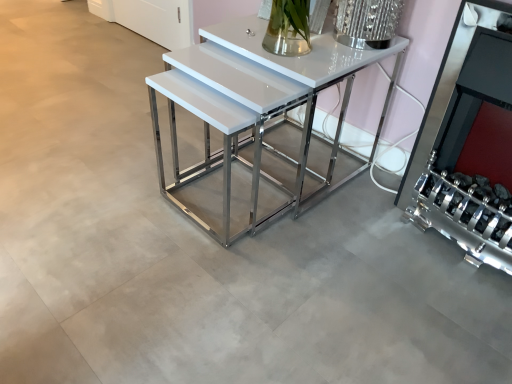
Measure the distance between white glossy table at center and camera.

white glossy table at center is 87.85 centimeters away from camera.

Describe the element at coordinates (259, 112) in the screenshot. I see `white glossy table at center` at that location.

This screenshot has width=512, height=384. In order to click on white glossy table at center in this screenshot , I will do `click(259, 112)`.

What is the approximate width of white glossy table at center?

The width of white glossy table at center is 25.65 inches.

This screenshot has height=384, width=512. Identify the location of silver metallic fireplace at right. (466, 139).

This screenshot has height=384, width=512. What do you see at coordinates (466, 139) in the screenshot? I see `silver metallic fireplace at right` at bounding box center [466, 139].

In order to click on white glossy table at center in this screenshot , I will do `click(259, 112)`.

Based on the photo, is white glossy table at center to the left of silver metallic fireplace at right from the viewer's perspective?

Yes.

Is the depth of white glossy table at center greater than that of silver metallic fireplace at right?

Yes, white glossy table at center is behind silver metallic fireplace at right.

Is point (239, 144) closer to viewer compared to point (469, 129)?

No, (239, 144) is further to viewer.

From the image's perspective, is white glossy table at center below silver metallic fireplace at right?

No.

From a real-world perspective, is white glossy table at center on top of silver metallic fireplace at right?

Incorrect, from a real-world perspective, white glossy table at center is lower than silver metallic fireplace at right.

Between white glossy table at center and silver metallic fireplace at right, which one has larger width?

white glossy table at center is wider.

Who is shorter, white glossy table at center or silver metallic fireplace at right?

With less height is white glossy table at center.

Does white glossy table at center have a larger size compared to silver metallic fireplace at right?

Indeed, white glossy table at center has a larger size compared to silver metallic fireplace at right.

Would you say white glossy table at center is inside or outside silver metallic fireplace at right?

white glossy table at center is outside silver metallic fireplace at right.

Would you consider white glossy table at center to be distant from silver metallic fireplace at right?

They are positioned close to each other.

Does white glossy table at center turn towards silver metallic fireplace at right?

No, white glossy table at center is not turned towards silver metallic fireplace at right.

How many degrees apart are the facing directions of white glossy table at center and silver metallic fireplace at right?

0.549 degrees.

How far apart are white glossy table at center and silver metallic fireplace at right?

white glossy table at center is 14.91 inches from silver metallic fireplace at right.

Locate an element on the screen. table on the left of silver metallic fireplace at right is located at coordinates (259, 112).

Does silver metallic fireplace at right appear on the right side of white glossy table at center?

Yes.

In the image, is silver metallic fireplace at right positioned in front of or behind white glossy table at center?

In the image, silver metallic fireplace at right appears in front of white glossy table at center.

Does point (434, 217) come closer to viewer compared to point (224, 131)?

No.

From the image's perspective, which object appears higher, silver metallic fireplace at right or white glossy table at center?

white glossy table at center.

From a real-world perspective, who is located lower, silver metallic fireplace at right or white glossy table at center?

white glossy table at center, from a real-world perspective.

Considering the relative sizes of silver metallic fireplace at right and white glossy table at center in the image provided, is silver metallic fireplace at right thinner than white glossy table at center?

Indeed, silver metallic fireplace at right has a lesser width compared to white glossy table at center.

In the scene shown: Is silver metallic fireplace at right shorter than white glossy table at center?

No.

Between silver metallic fireplace at right and white glossy table at center, which one has larger size?

Bigger between the two is white glossy table at center.

Would you say silver metallic fireplace at right is outside white glossy table at center?

Indeed, silver metallic fireplace at right is completely outside white glossy table at center.

Is silver metallic fireplace at right in contact with white glossy table at center?

No, silver metallic fireplace at right is not with white glossy table at center.

Is silver metallic fireplace at right turned away from white glossy table at center?

No, white glossy table at center is not at the back of silver metallic fireplace at right.

You are a GUI agent. You are given a task and a screenshot of the screen. Output one action in this format:
    pyautogui.click(x=<x>, y=<y>)
    Task: Click on the fireplace above the white glossy table at center (from a real-world perspective)
    Image resolution: width=512 pixels, height=384 pixels.
    Given the screenshot: What is the action you would take?
    pyautogui.click(x=466, y=139)

Identify the location of table on the left of silver metallic fireplace at right. (259, 112).

Identify the location of fireplace in front of the white glossy table at center. (466, 139).